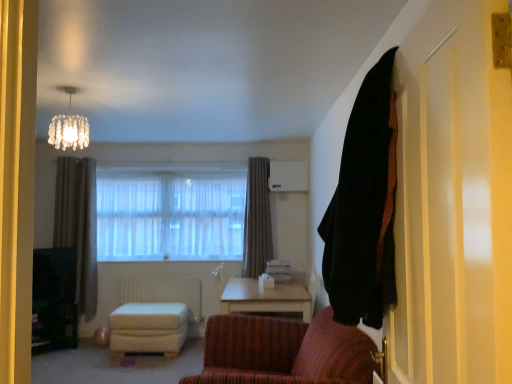
Question: Is dark gray textured curtain at left, the 2th curtain positioned from the front, positioned with its back to white fabric stool at center?

Choices:
 (A) no
 (B) yes

Answer: (A)

Question: Considering the relative sizes of dark gray textured curtain at left, the 2th curtain positioned from the front, and white fabric stool at center in the image provided, is dark gray textured curtain at left, the 2th curtain positioned from the front, thinner than white fabric stool at center?

Choices:
 (A) no
 (B) yes

Answer: (B)

Question: Considering the relative sizes of dark gray textured curtain at left, the 2th curtain positioned from the front, and white fabric stool at center in the image provided, is dark gray textured curtain at left, the 2th curtain positioned from the front, taller than white fabric stool at center?

Choices:
 (A) yes
 (B) no

Answer: (A)

Question: Considering the relative positions of dark gray textured curtain at left, the 2th curtain positioned from the front, and white fabric stool at center in the image provided, is dark gray textured curtain at left, the 2th curtain positioned from the front, to the right of white fabric stool at center from the viewer's perspective?

Choices:
 (A) yes
 (B) no

Answer: (B)

Question: Is dark gray textured curtain at left, marked as the second curtain in a back-to-front arrangement, wider than white fabric stool at center?

Choices:
 (A) yes
 (B) no

Answer: (B)

Question: Would you say white matte radiator at lower center is inside or outside black fabric curtain at upper right, the 1th curtain when ordered from front to back?

Choices:
 (A) inside
 (B) outside

Answer: (B)

Question: Considering the relative positions of white matte radiator at lower center and black fabric curtain at upper right, the 1th curtain when ordered from front to back, in the image provided, is white matte radiator at lower center to the left or to the right of black fabric curtain at upper right, the 1th curtain when ordered from front to back,?

Choices:
 (A) right
 (B) left

Answer: (B)

Question: Relative to black fabric curtain at upper right, which ranks as the 3th curtain in left-to-right order, is white matte radiator at lower center in front or behind?

Choices:
 (A) behind
 (B) front

Answer: (A)

Question: Is white matte radiator at lower center bigger or smaller than black fabric curtain at upper right, the first curtain positioned from the right?

Choices:
 (A) small
 (B) big

Answer: (A)

Question: Considering the positions of brown fabric curtain at center, marked as the second curtain in a left-to-right arrangement, and white matte radiator at lower center in the image, is brown fabric curtain at center, marked as the second curtain in a left-to-right arrangement, taller or shorter than white matte radiator at lower center?

Choices:
 (A) short
 (B) tall

Answer: (B)

Question: Considering their positions, is brown fabric curtain at center, marked as the second curtain in a left-to-right arrangement, located in front of or behind white matte radiator at lower center?

Choices:
 (A) behind
 (B) front

Answer: (B)

Question: Is point (250, 168) closer or farther from the camera than point (161, 276)?

Choices:
 (A) closer
 (B) farther

Answer: (A)

Question: Based on their positions, is brown fabric curtain at center, the 1th curtain viewed from the back, located to the left or right of white matte radiator at lower center?

Choices:
 (A) right
 (B) left

Answer: (A)

Question: From a real-world perspective, is crystal glass chandelier at upper center physically located above or below light wood table at center?

Choices:
 (A) below
 (B) above

Answer: (B)

Question: Does point (72, 120) appear closer or farther from the camera than point (222, 294)?

Choices:
 (A) closer
 (B) farther

Answer: (A)